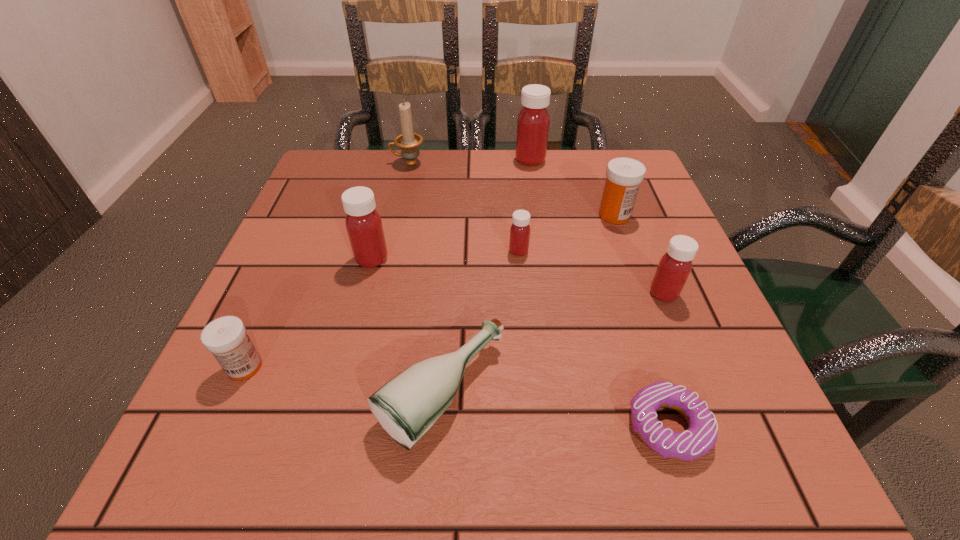
Locate an element on the screen. This screenshot has height=540, width=960. doughnut that is at the right edge is located at coordinates (701, 436).

Where is `object at the near right corner`? object at the near right corner is located at coordinates (701, 436).

You are a GUI agent. You are given a task and a screenshot of the screen. Output one action in this format:
    pyautogui.click(x=<x>, y=<y>)
    Task: Click on the vacant region at the far edge
    This screenshot has height=540, width=960.
    Given the screenshot: What is the action you would take?
    pyautogui.click(x=579, y=204)

In the image, there is a desktop. Where is `vacant region at the near edge`? The height and width of the screenshot is (540, 960). vacant region at the near edge is located at coordinates (379, 479).

Locate an element on the screen. This screenshot has height=540, width=960. vacant region at the left edge of the desktop is located at coordinates 291,266.

This screenshot has width=960, height=540. In order to click on vacant point at the right edge in this screenshot , I will do `click(626, 281)`.

I want to click on vacant space at the near left corner of the desktop, so click(219, 481).

At what (x,y) coordinates should I click in order to perform the action: click on vacant region at the far right corner of the desktop. Please return your answer as a coordinate pair (x, y). Looking at the image, I should click on (588, 157).

Where is `vacant space at the near right corner of the desktop`? The width and height of the screenshot is (960, 540). vacant space at the near right corner of the desktop is located at coordinates (728, 432).

Find the location of `vacant area that lies between the leftmost red medicine and the doughnut`. vacant area that lies between the leftmost red medicine and the doughnut is located at coordinates (520, 342).